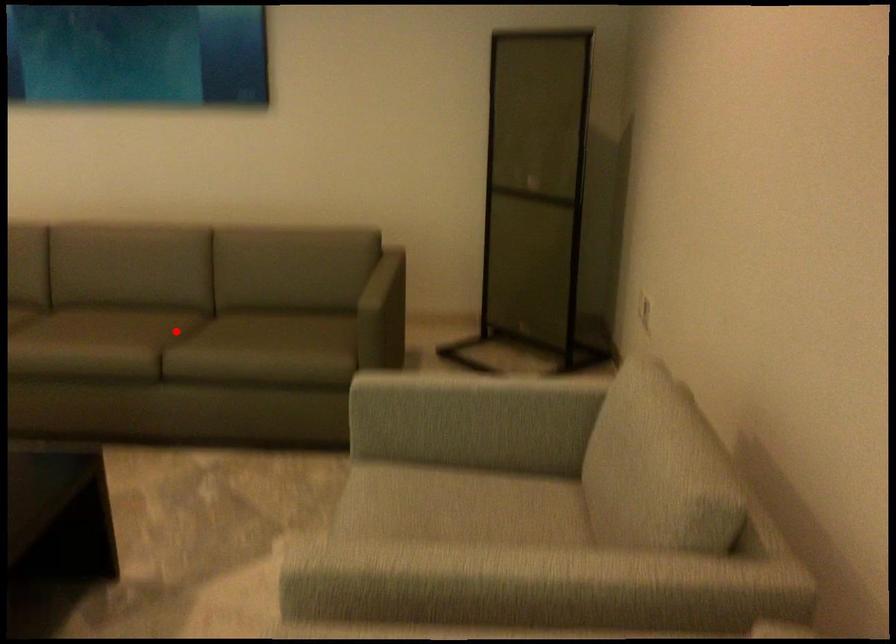
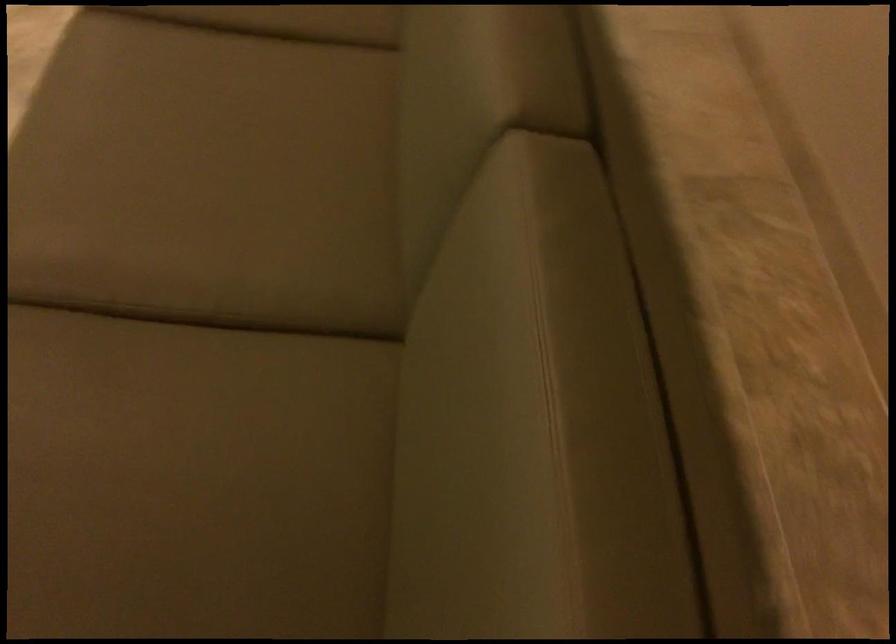
Locate, in the second image, the point that corresponds to the highlighted location in the first image.

(211, 339)